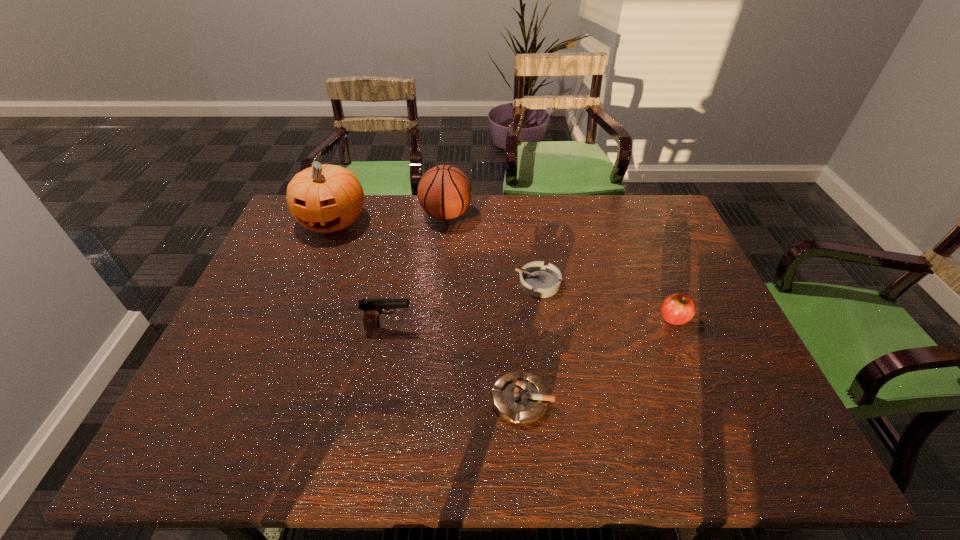
At what (x,y) coordinates should I click in order to perform the action: click on free space at the far edge of the desktop. Please return your answer as a coordinate pair (x, y). This screenshot has width=960, height=540. Looking at the image, I should click on (409, 225).

Locate an element on the screen. This screenshot has width=960, height=540. vacant space at the near edge is located at coordinates (443, 426).

The height and width of the screenshot is (540, 960). What are the coordinates of `vacant region at the right edge of the desktop` in the screenshot? It's located at (719, 361).

Image resolution: width=960 pixels, height=540 pixels. In order to click on vacant region at the far right corner in this screenshot , I will do pos(652,197).

This screenshot has width=960, height=540. I want to click on vacant space that's between the nearer ashtray and the farther ashtray, so click(530, 341).

Find the location of a particular element. The height and width of the screenshot is (540, 960). empty space that is in between the farther ashtray and the nearest object is located at coordinates (530, 341).

The image size is (960, 540). Identify the location of vacant space that is in between the nearer ashtray and the leftmost object. (427, 310).

Find the location of a particular element. The width and height of the screenshot is (960, 540). unoccupied position between the second tallest object and the nearer ashtray is located at coordinates (484, 307).

Locate an element on the screen. The image size is (960, 540). free point between the farther ashtray and the nearer ashtray is located at coordinates (530, 341).

This screenshot has height=540, width=960. What are the coordinates of `free space that is in between the pistol and the third shortest object` in the screenshot? It's located at (531, 322).